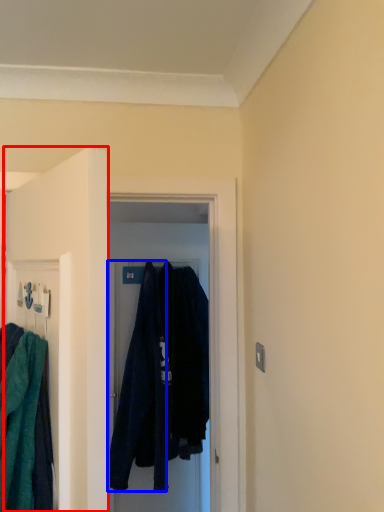
Question: Which of the following is the closest to the observer, door (highlighted by a red box) or robe (highlighted by a blue box)?

Choices:
 (A) door
 (B) robe

Answer: (A)